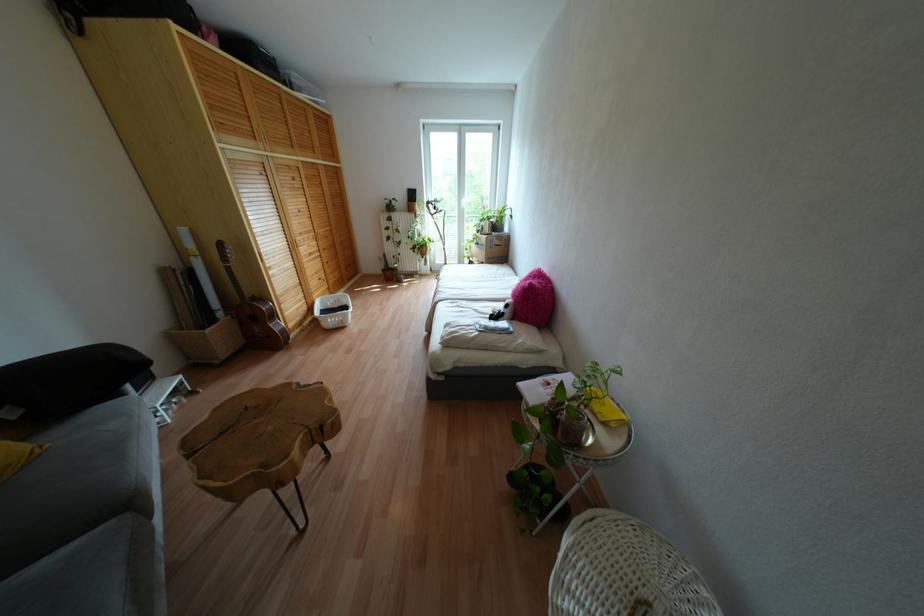
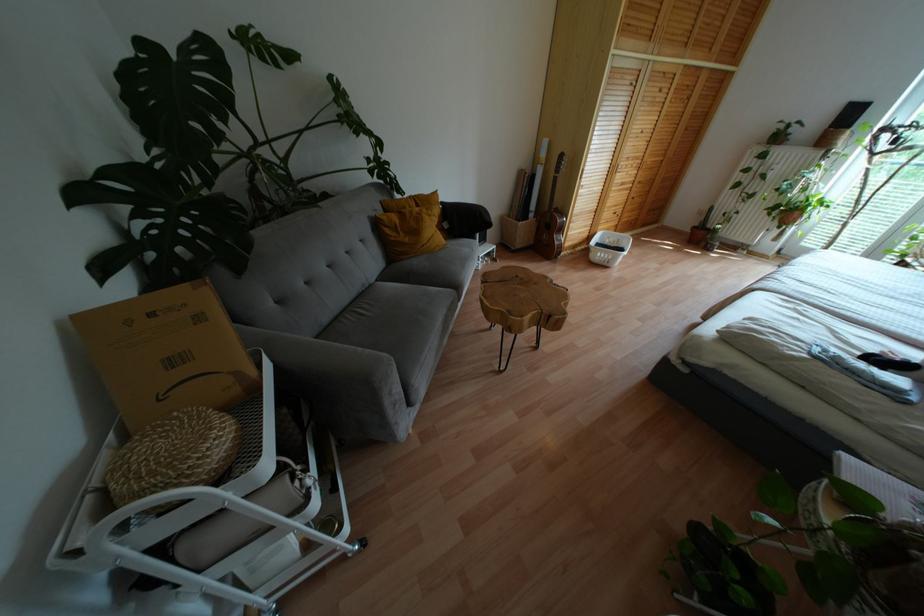
The point at (383, 270) is marked in the first image. Where is the corresponding point in the second image?

(694, 227)